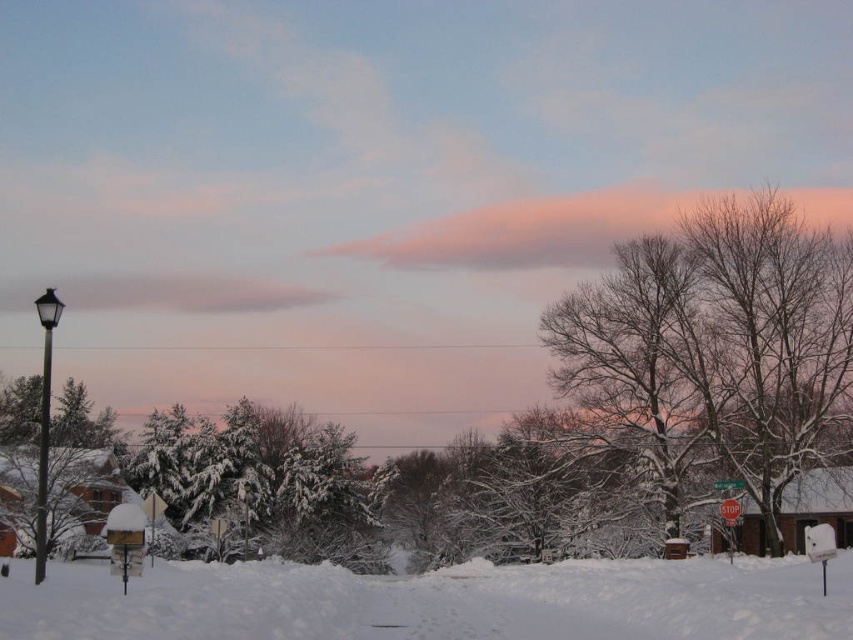
Question: Which point is farther to the camera?

Choices:
 (A) (567, 570)
 (B) (566, 314)
 (C) (44, 376)

Answer: (B)

Question: Estimate the real-world distances between objects in this image. Which object is farther from the black metal lamp post at left?

Choices:
 (A) white fluffy snow at lower center
 (B) bare branches at upper right

Answer: (B)

Question: Which point is closer to the camera?

Choices:
 (A) white fluffy snow at lower center
 (B) bare branches at upper right
 (C) black metal lamp post at left

Answer: (A)

Question: Is the position of bare branches at upper right less distant than that of white fluffy snow at lower center?

Choices:
 (A) yes
 (B) no

Answer: (B)

Question: Considering the relative positions of white fluffy snow at lower center and black metal lamp post at left in the image provided, where is white fluffy snow at lower center located with respect to black metal lamp post at left?

Choices:
 (A) below
 (B) above

Answer: (B)

Question: Does white fluffy snow at lower center appear over black metal lamp post at left?

Choices:
 (A) no
 (B) yes

Answer: (B)